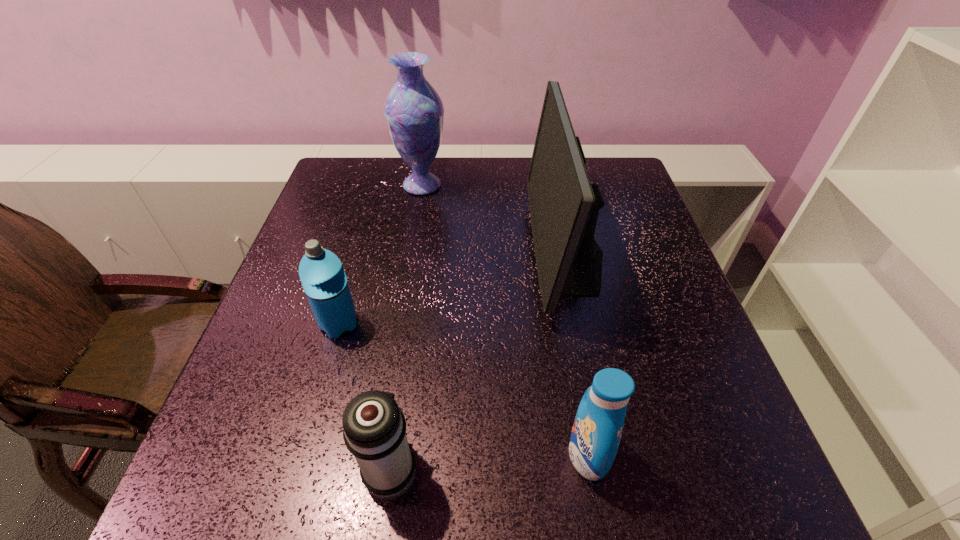
Locate an element on the screen. The height and width of the screenshot is (540, 960). object that is the fourth closest one to the detergent is located at coordinates coord(414,112).

Locate which object ranks second in proximity to the computer monitor. Please provide its 2D coordinates. Your answer should be formatted as a tuple, i.e. [(x, y)], where the tuple contains the x and y coordinates of a point satisfying the conditions above.

[(414, 112)]